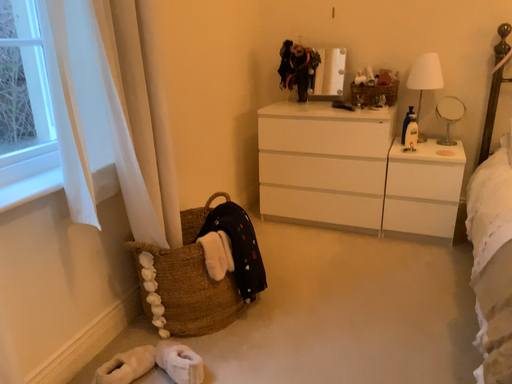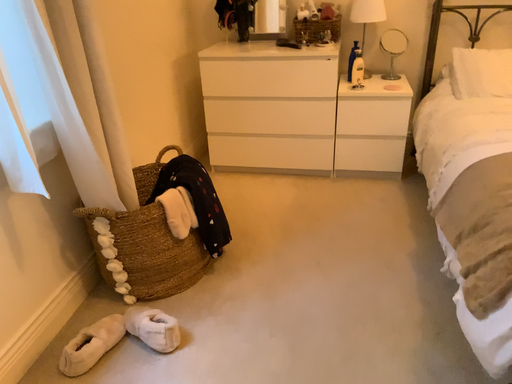
Question: How did the camera likely rotate when shooting the video?

Choices:
 (A) rotated upward
 (B) rotated downward

Answer: (B)